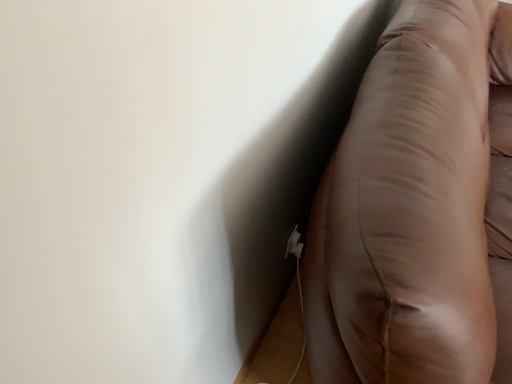
Describe the element at coordinates (419, 209) in the screenshot. I see `brown leather couch at right` at that location.

Locate an element on the screen. The height and width of the screenshot is (384, 512). brown leather couch at right is located at coordinates (419, 209).

Measure the distance between point (x=354, y=182) and camera.

24.49 inches.

Where is `brown leather couch at right`? The width and height of the screenshot is (512, 384). brown leather couch at right is located at coordinates (419, 209).